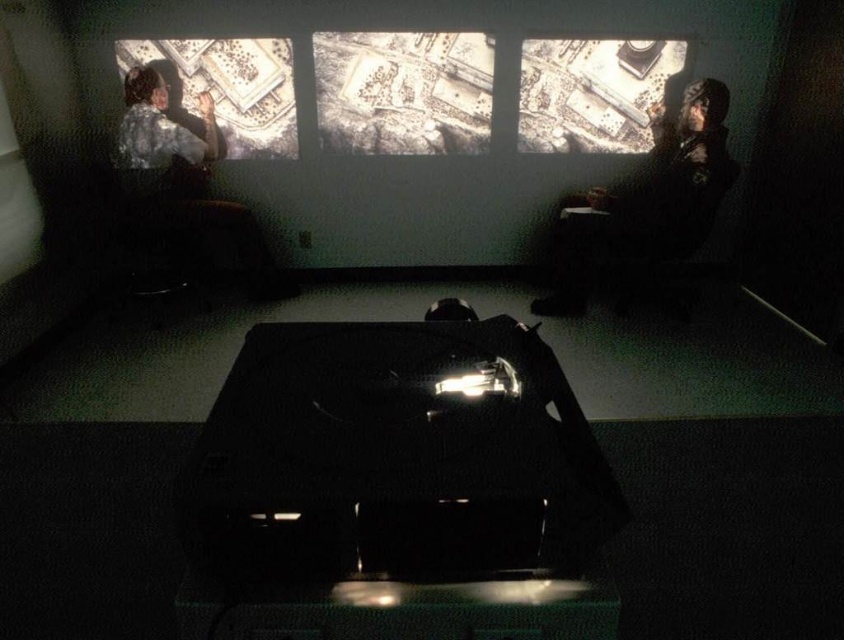
You are an interior designer assessing the room layout. The black glossy projector at center and the matte paper map at upper left are both on the table. Which object has a greater height?

The matte paper map at upper left is taller than the black glossy projector at center, so it has a greater height.